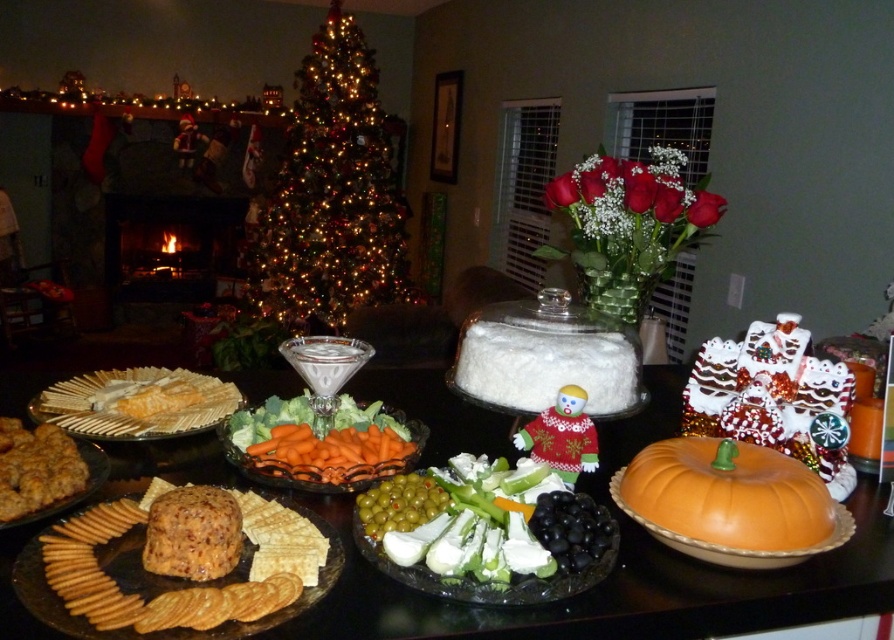
From the picture: You are standing in the room and want to place a new decoration on the mantelpiece. To do so, you need to walk around the green artificial christmas tree at center. Which direction should you move relative to the tree to reach the mantelpiece?

Since the green artificial christmas tree at center is located at point coordinates, you should move to the left or right side of the tree to reach the mantelpiece.

You are a guest at a holiday party and want to grab a cracker from the brown cracker at lower left. To reach it, you need to walk around the green artificial christmas tree at center. Which direction should you move relative to the tree to get to the cracker?

The green artificial christmas tree at center is above the brown cracker at lower left, so you should move downward or to the lower area away from the tree to reach the brown cracker at lower left.